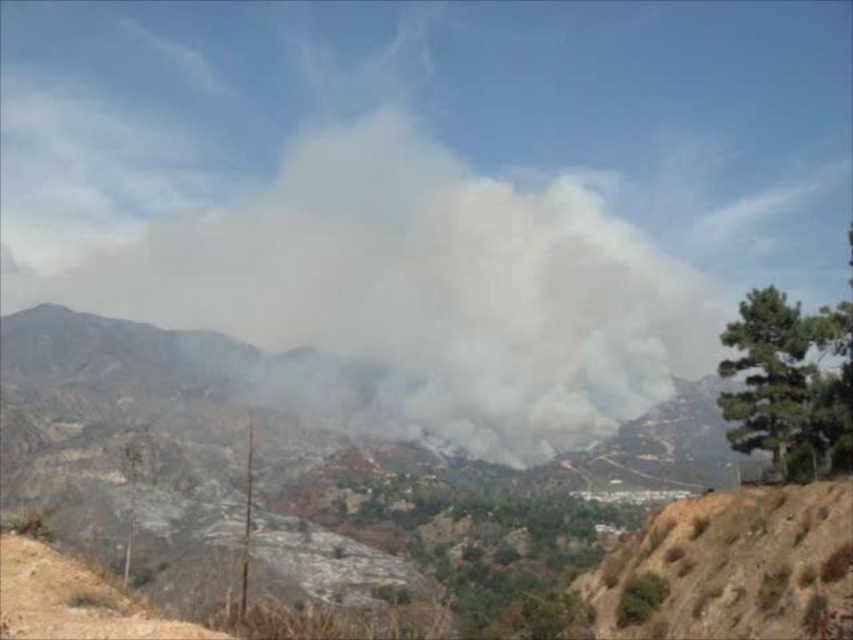
You are a hiker trying to navigate to the mountain trailhead. You see the white smoke at center and the brown dirt track at lower left. Which direction should you head towards to avoid the smoke?

The white smoke at center is positioned over the brown dirt track at lower left, so to avoid the smoke, you should head away from the brown dirt track at lower left and move towards the opposite direction of the smoke.